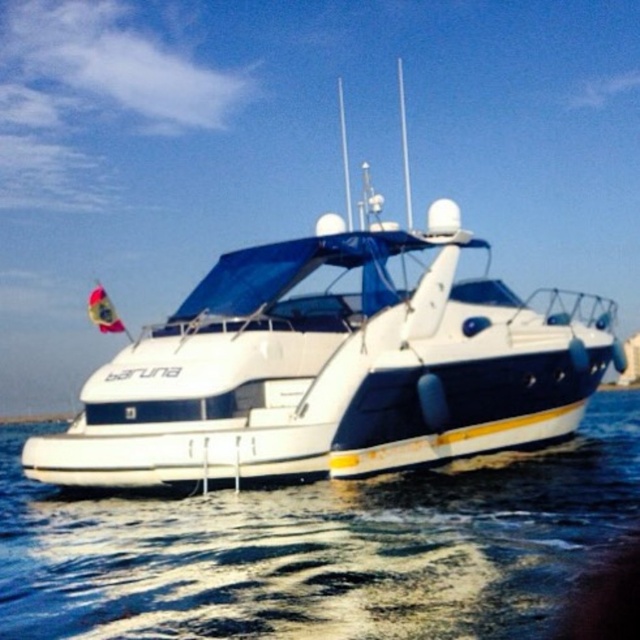
Is point (477, 422) positioned in front of point (148, 596)?

No, it is behind (148, 596).

Is point (460, 332) positioned behind point (444, 506)?

Yes, point (460, 332) is farther from viewer.

Identify the location of white glossy boat at center. (333, 369).